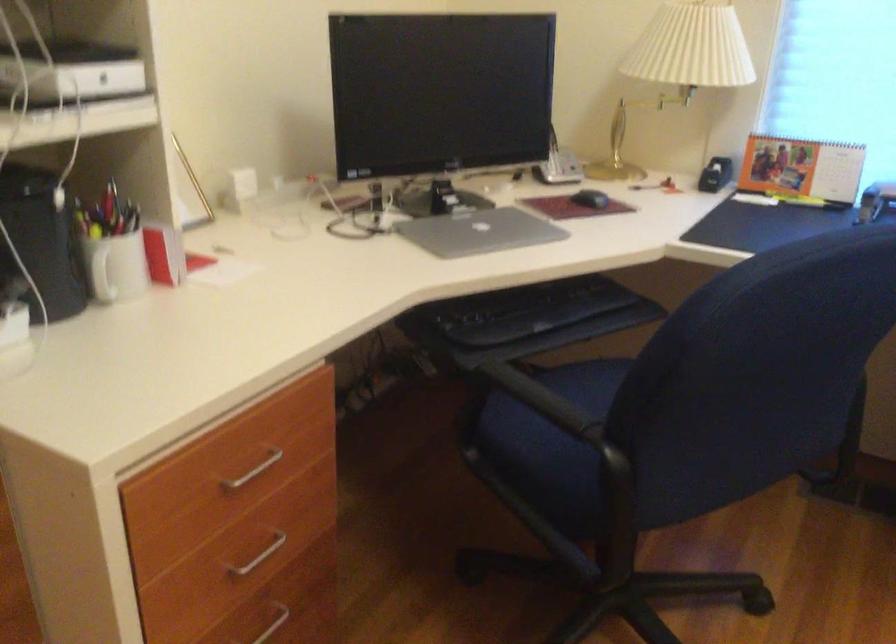
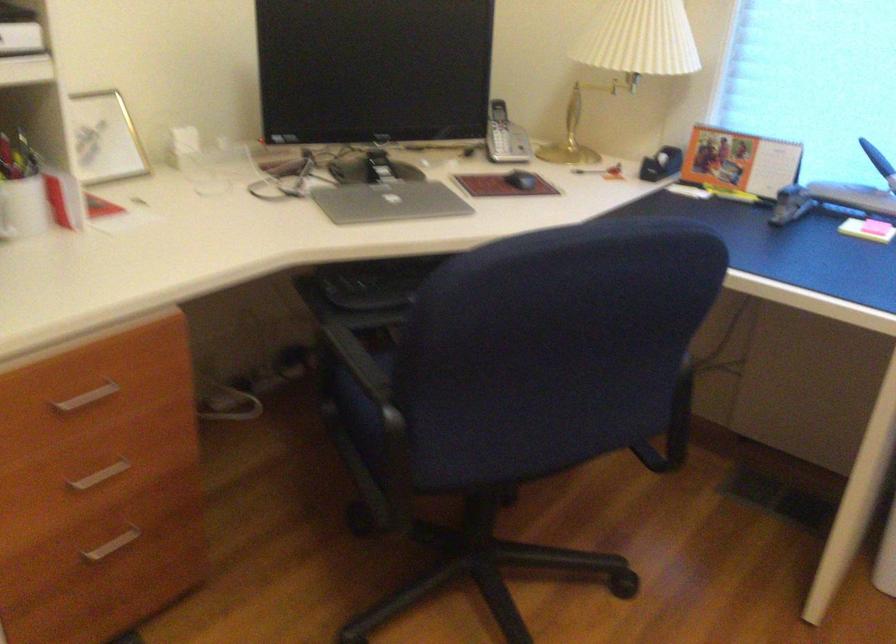
Find the pixel in the second image that matches pixel 493 448 in the first image.

(352, 404)